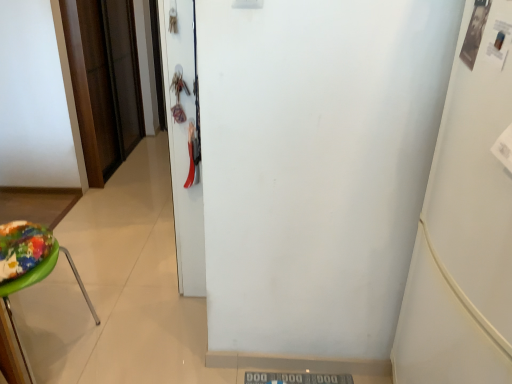
Question: Is brown wood door at left, marked as the first door in a left-to-right arrangement, placed right next to white matte refrigerator at right?

Choices:
 (A) no
 (B) yes

Answer: (A)

Question: From a real-world perspective, is brown wood door at left, marked as the first door in a left-to-right arrangement, located higher than white matte refrigerator at right?

Choices:
 (A) no
 (B) yes

Answer: (A)

Question: Does brown wood door at left, acting as the second door starting from the front, appear on the right side of white matte refrigerator at right?

Choices:
 (A) no
 (B) yes

Answer: (A)

Question: Can you confirm if brown wood door at left, marked as the first door in a left-to-right arrangement, is thinner than white matte refrigerator at right?

Choices:
 (A) yes
 (B) no

Answer: (A)

Question: Does brown wood door at left, acting as the second door starting from the front, have a larger size compared to white matte refrigerator at right?

Choices:
 (A) no
 (B) yes

Answer: (A)

Question: Is brown wood door at left, which appears as the 1th door when viewed from the back, further to the viewer compared to white matte refrigerator at right?

Choices:
 (A) yes
 (B) no

Answer: (A)

Question: Is green plastic stool at left wider than white glossy door at center, positioned as the second door in back-to-front order?

Choices:
 (A) yes
 (B) no

Answer: (A)

Question: From a real-world perspective, is green plastic stool at left located higher than white glossy door at center, which appears as the 2th door when viewed from the left?

Choices:
 (A) yes
 (B) no

Answer: (B)

Question: From the image's perspective, is green plastic stool at left located beneath white glossy door at center, which appears as the 2th door when viewed from the left?

Choices:
 (A) yes
 (B) no

Answer: (A)

Question: Considering the relative sizes of green plastic stool at left and white glossy door at center, positioned as the second door in back-to-front order, in the image provided, is green plastic stool at left bigger than white glossy door at center, positioned as the second door in back-to-front order,?

Choices:
 (A) no
 (B) yes

Answer: (B)

Question: Considering the relative sizes of green plastic stool at left and white glossy door at center, which is the 1th door in right-to-left order, in the image provided, is green plastic stool at left shorter than white glossy door at center, which is the 1th door in right-to-left order,?

Choices:
 (A) yes
 (B) no

Answer: (A)

Question: Is green plastic stool at left positioned behind white glossy door at center, which appears as the 2th door when viewed from the left?

Choices:
 (A) yes
 (B) no

Answer: (B)

Question: Is the position of white matte refrigerator at right less distant than that of brown wood door at left, which is the second door in right-to-left order?

Choices:
 (A) no
 (B) yes

Answer: (B)